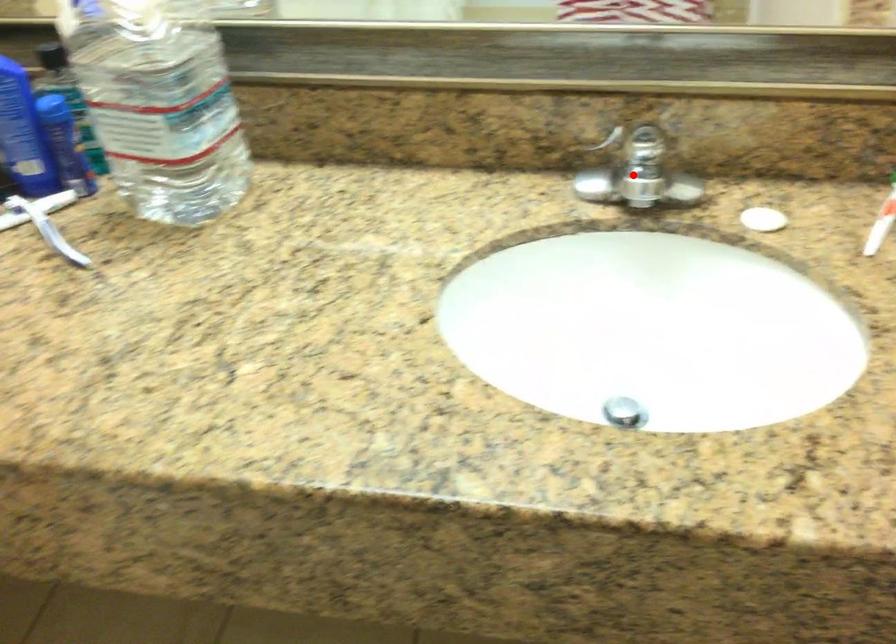
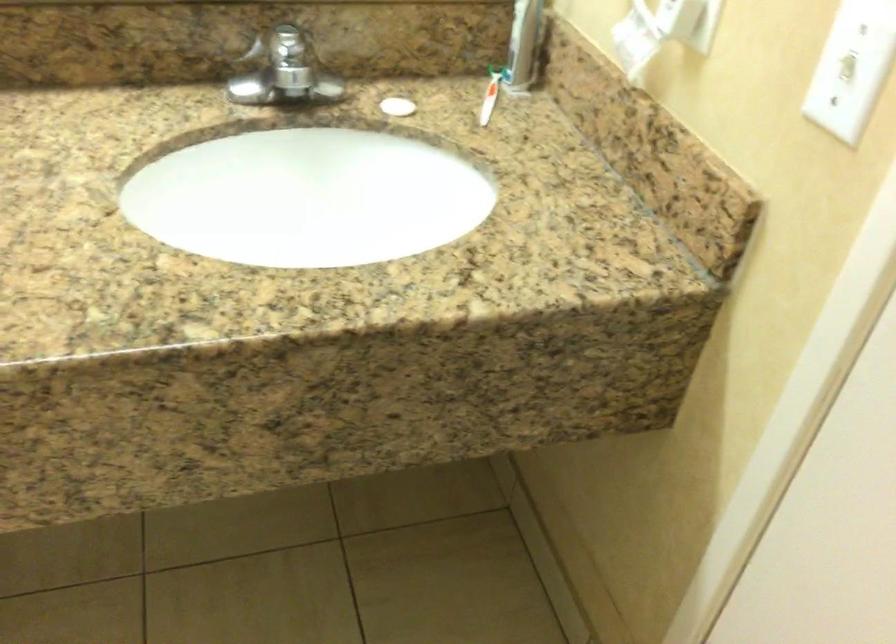
In the second image, find the point that corresponds to the highlighted location in the first image.

(285, 69)